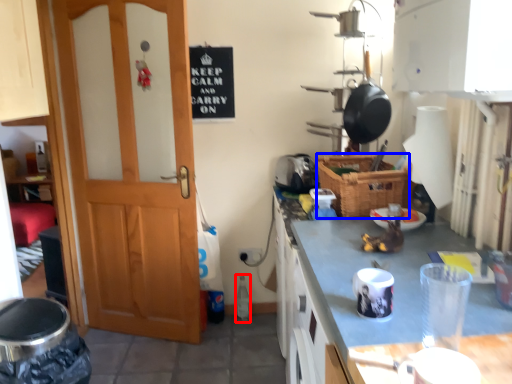
Question: Which object appears farthest to the camera in this image, bottle (highlighted by a red box) or basket (highlighted by a blue box)?

Choices:
 (A) bottle
 (B) basket

Answer: (A)